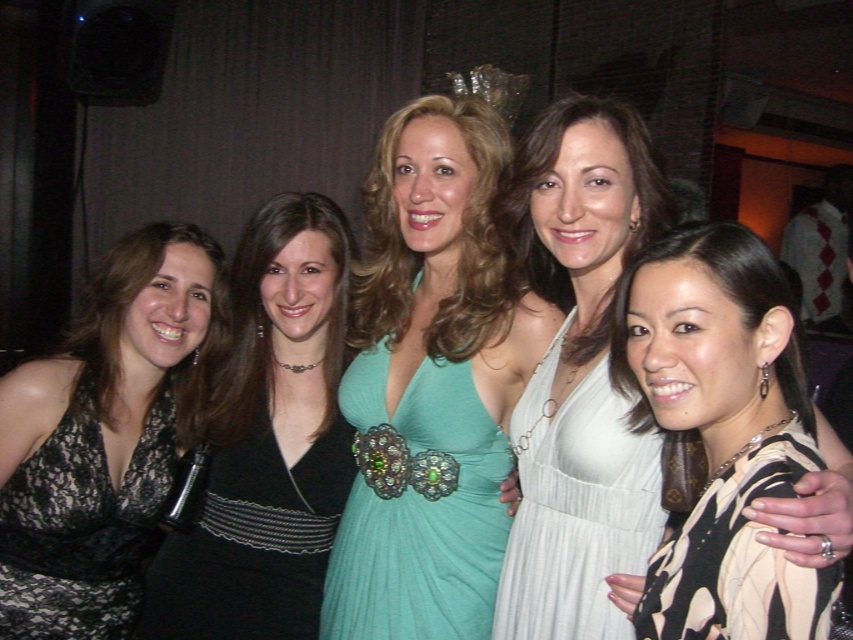
Question: Which point is closer to the camera?

Choices:
 (A) (517, 456)
 (B) (225, 433)
 (C) (67, 468)

Answer: (A)

Question: Does lace fabric dress at left have a lesser width compared to printed silk blouse at lower right?

Choices:
 (A) yes
 (B) no

Answer: (B)

Question: From the image, what is the correct spatial relationship of white satin dress at center in relation to lace fabric dress at left?

Choices:
 (A) left
 (B) right

Answer: (B)

Question: Among these points, which one is farthest from the camera?

Choices:
 (A) (311, 227)
 (B) (404, 580)
 (C) (117, 544)
 (D) (744, 560)

Answer: (C)

Question: Which point is closer to the camera taking this photo?

Choices:
 (A) (339, 416)
 (B) (518, 538)
 (C) (773, 472)

Answer: (C)

Question: Does teal satin dress at center appear over white pleated dress at center?

Choices:
 (A) no
 (B) yes

Answer: (B)